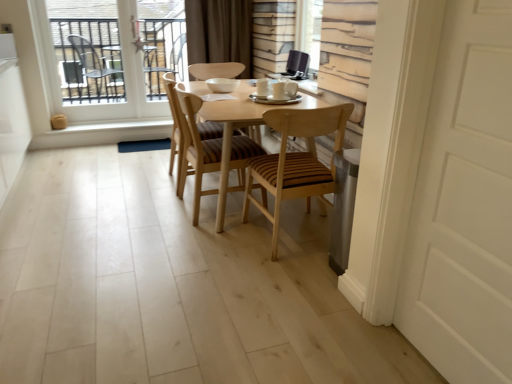
Where is `free space in front of woodenchair at center, placed as the 2th chair when sorted from left to right`? The height and width of the screenshot is (384, 512). free space in front of woodenchair at center, placed as the 2th chair when sorted from left to right is located at coordinates (198, 240).